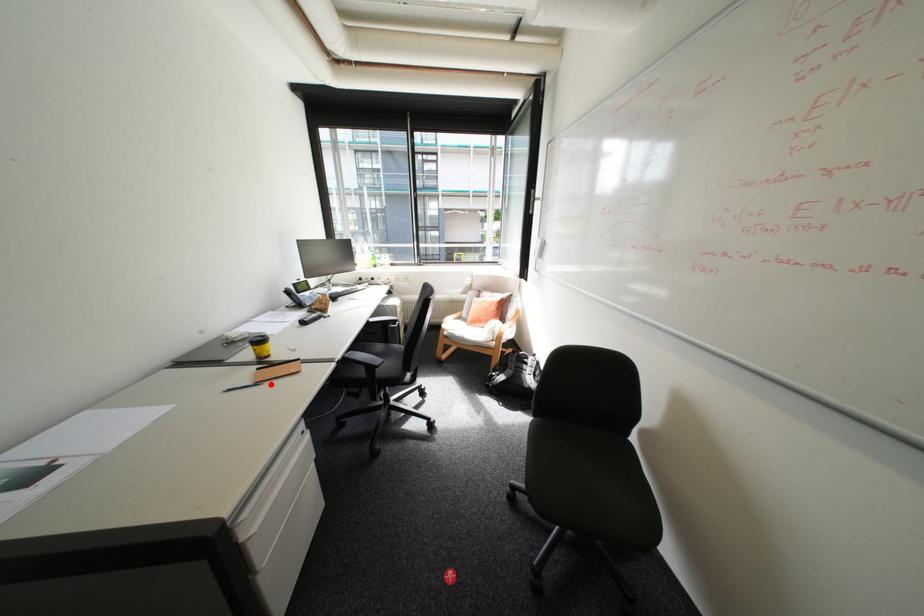
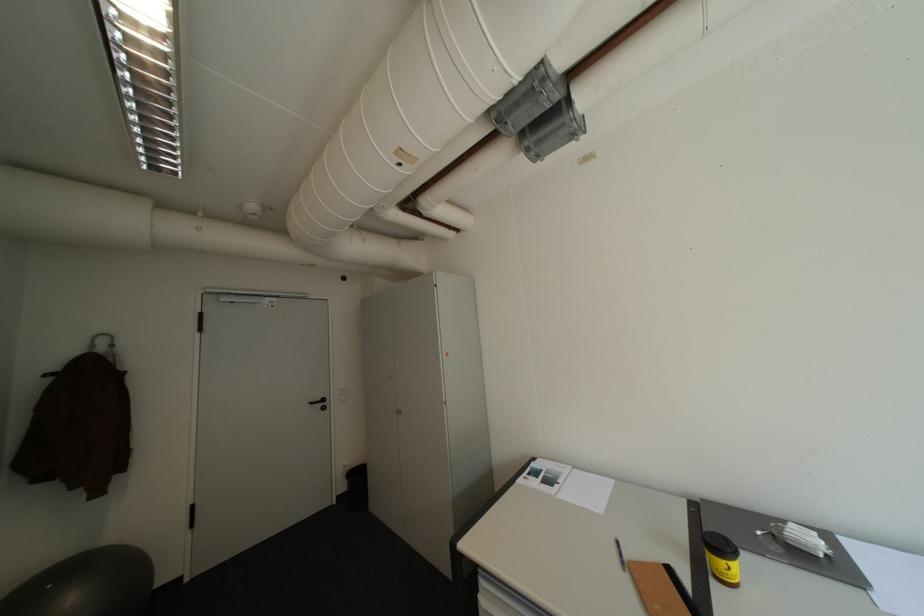
Find the pixel in the second image that matches the highlighted location in the first image.

(634, 570)